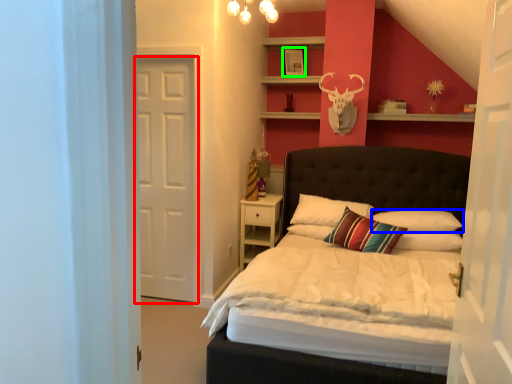
Question: Based on their relative distances, which object is farther from door (highlighted by a red box)? Choose from pillow (highlighted by a blue box) and picture frame (highlighted by a green box).

Choices:
 (A) pillow
 (B) picture frame

Answer: (A)